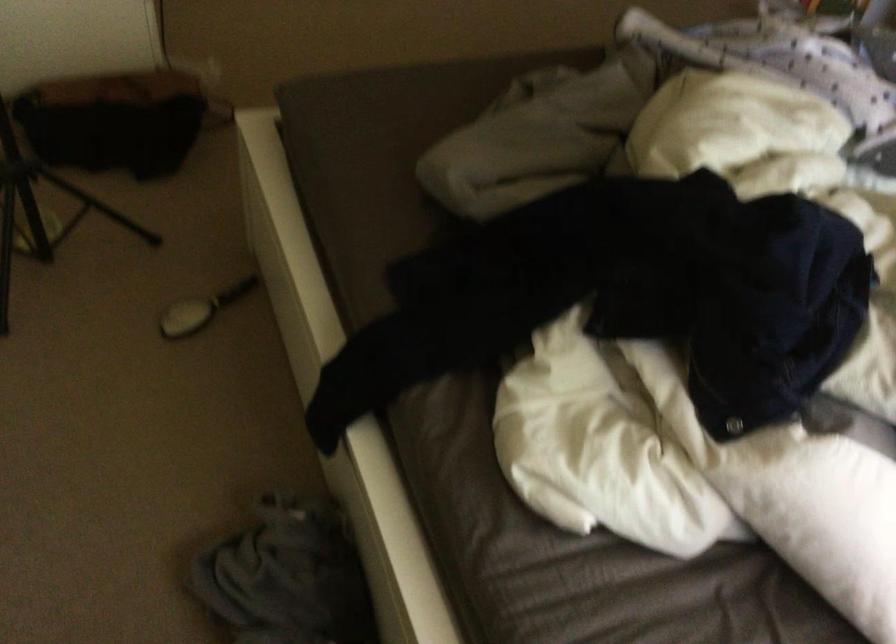
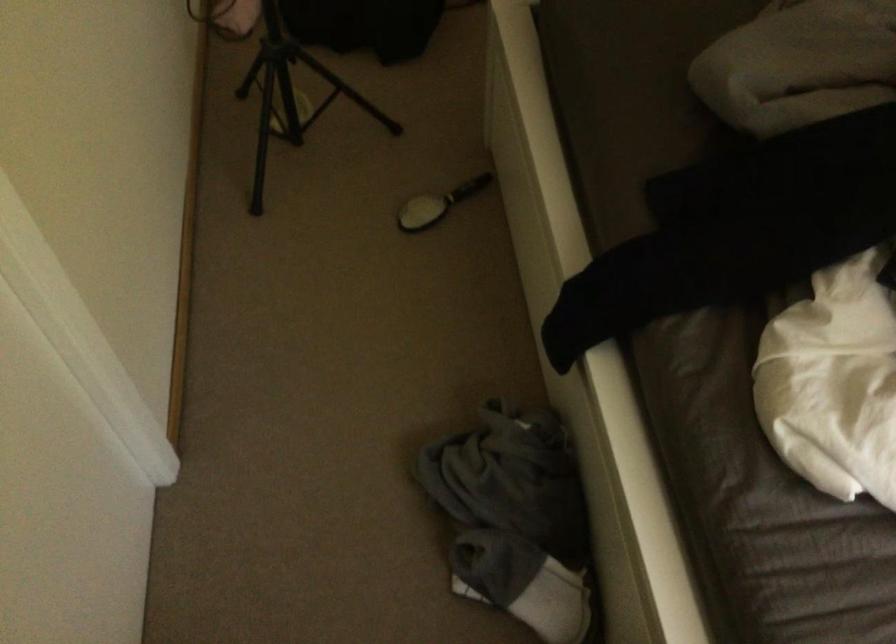
Locate, in the second image, the point that corresponds to the point at 201,313 in the first image.

(437, 204)